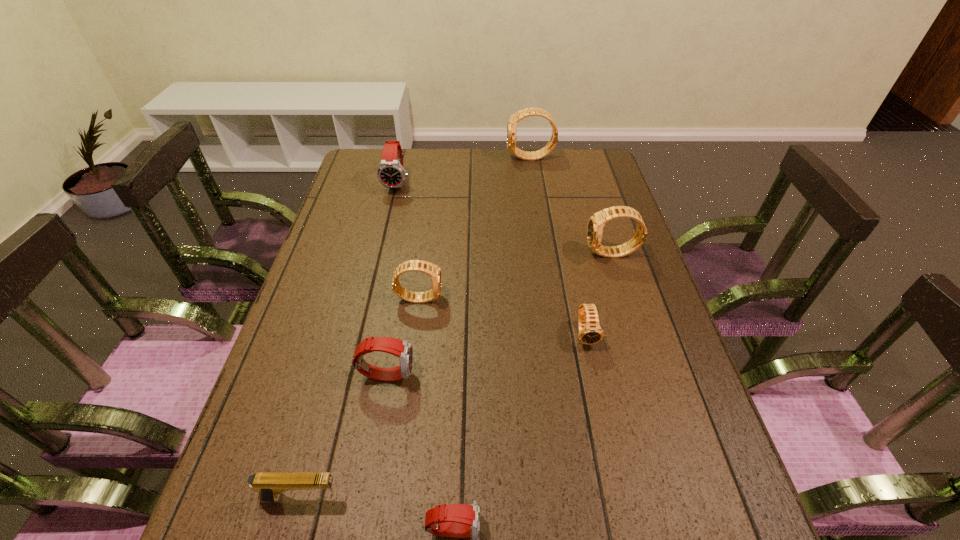
You are a GUI agent. You are given a task and a screenshot of the screen. Output one action in this format:
    pyautogui.click(x=<x>, y=<y>)
    Task: Click on the tan pistol
    
    Given the screenshot: What is the action you would take?
    pyautogui.click(x=270, y=485)

Where is `pistol`? This screenshot has height=540, width=960. pistol is located at coordinates (270, 485).

Locate an element on the screen. Image resolution: width=960 pixels, height=540 pixels. the fourth nearest object is located at coordinates (590, 332).

Find the location of `the nearest black watch`. the nearest black watch is located at coordinates (590, 332).

At what (x,y) coordinates should I click in order to perform the action: click on vacant position located on the face of the farthest object. Please return your answer as a coordinate pair (x, y). Looking at the image, I should click on (488, 158).

The height and width of the screenshot is (540, 960). I want to click on free region located 0.090m on the face of the farthest object, so click(x=483, y=158).

Find the location of a particular element. This screenshot has width=960, height=540. vacant space located 0.370m on the face of the farthest object is located at coordinates (407, 158).

In order to click on free space located on the face of the second farthest black watch in this screenshot , I will do `click(470, 254)`.

The image size is (960, 540). In order to click on vacant region located on the face of the second farthest black watch in this screenshot , I will do `click(558, 254)`.

This screenshot has width=960, height=540. I want to click on vacant area located 0.320m on the face of the second farthest black watch, so click(474, 254).